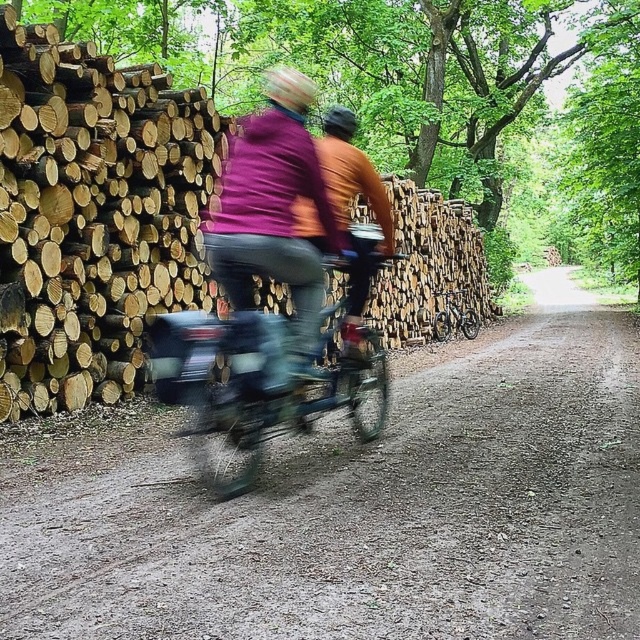
Based on the photo, is dirt track at center to the left of matte purple jacket at center from the viewer's perspective?

Incorrect, dirt track at center is not on the left side of matte purple jacket at center.

Measure the distance between dirt track at center and matte purple jacket at center.

A distance of 2.75 meters exists between dirt track at center and matte purple jacket at center.

Between point (3, 456) and point (298, 148), which one is positioned behind?

The point (3, 456) is more distant.

Where is `dirt track at center`? The image size is (640, 640). dirt track at center is located at coordinates (360, 508).

From the picture: Who is higher up, orange fabric jacket at center or shiny metallic bicycle at center?

orange fabric jacket at center

Who is taller, orange fabric jacket at center or shiny metallic bicycle at center?

orange fabric jacket at center

What do you see at coordinates (348, 209) in the screenshot? This screenshot has height=640, width=640. I see `orange fabric jacket at center` at bounding box center [348, 209].

Locate an element on the screen. orange fabric jacket at center is located at coordinates (348, 209).

Can you confirm if natural wood logs at left is thinner than matte purple jacket at center?

No, natural wood logs at left is not thinner than matte purple jacket at center.

Between point (38, 228) and point (230, 189), which one is positioned in front?

Point (230, 189)

The width and height of the screenshot is (640, 640). I want to click on natural wood logs at left, so click(92, 214).